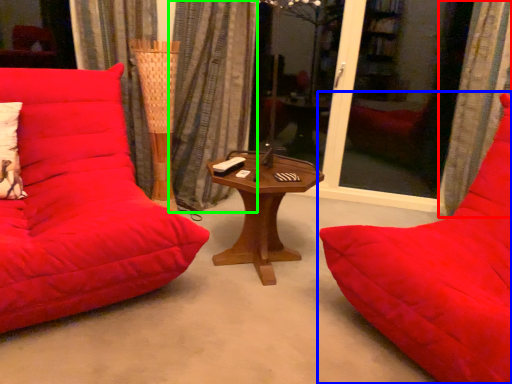
Question: Based on their relative distances, which object is farther from curtain (highlighted by a red box)? Choose from studio couch (highlighted by a blue box) and curtain (highlighted by a green box).

Choices:
 (A) studio couch
 (B) curtain

Answer: (B)